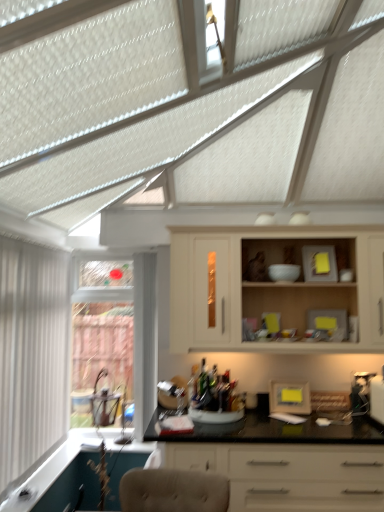
Question: From the image's perspective, would you say yellow matte frame at center is shown under white vertical blinds at left, the 2th window from the back?

Choices:
 (A) yes
 (B) no

Answer: (A)

Question: Is yellow matte frame at center completely or partially outside of white vertical blinds at left, the 2th window from the back?

Choices:
 (A) no
 (B) yes

Answer: (B)

Question: Considering the relative positions of yellow matte frame at center and white vertical blinds at left, which ranks as the 1th window in front-to-back order, in the image provided, is yellow matte frame at center to the right of white vertical blinds at left, which ranks as the 1th window in front-to-back order, from the viewer's perspective?

Choices:
 (A) yes
 (B) no

Answer: (A)

Question: Considering the relative sizes of yellow matte frame at center and white vertical blinds at left, the 2th window from the back, in the image provided, is yellow matte frame at center smaller than white vertical blinds at left, the 2th window from the back,?

Choices:
 (A) yes
 (B) no

Answer: (A)

Question: Is yellow matte frame at center to the left of white vertical blinds at left, which ranks as the 1th window in front-to-back order, from the viewer's perspective?

Choices:
 (A) yes
 (B) no

Answer: (B)

Question: In terms of size, does clear glass window at left, which is the second window from front to back, appear bigger or smaller than yellow matte frame at center?

Choices:
 (A) small
 (B) big

Answer: (B)

Question: Visually, is clear glass window at left, which is the second window from front to back, positioned to the left or to the right of yellow matte frame at center?

Choices:
 (A) left
 (B) right

Answer: (A)

Question: Considering their positions, is clear glass window at left, which is the second window from front to back, located in front of or behind yellow matte frame at center?

Choices:
 (A) behind
 (B) front

Answer: (A)

Question: Choose the correct answer: Is clear glass window at left, positioned as the first window in back-to-front order, inside yellow matte frame at center or outside it?

Choices:
 (A) inside
 (B) outside

Answer: (B)

Question: Is clear glass window at left, positioned as the first window in back-to-front order, spatially inside matte cream cabinet at center, or outside of it?

Choices:
 (A) inside
 (B) outside

Answer: (B)

Question: Is clear glass window at left, positioned as the first window in back-to-front order, wider or thinner than matte cream cabinet at center?

Choices:
 (A) thin
 (B) wide

Answer: (A)

Question: From a real-world perspective, is clear glass window at left, which is the second window from front to back, positioned above or below matte cream cabinet at center?

Choices:
 (A) above
 (B) below

Answer: (B)

Question: Does point (139, 286) appear closer or farther from the camera than point (231, 252)?

Choices:
 (A) closer
 (B) farther

Answer: (B)

Question: From a real-world perspective, is matte cream cabinet at center physically located above or below white vertical blinds at left, which ranks as the 1th window in front-to-back order?

Choices:
 (A) above
 (B) below

Answer: (A)

Question: Choose the correct answer: Is matte cream cabinet at center inside white vertical blinds at left, the 2th window from the back, or outside it?

Choices:
 (A) outside
 (B) inside

Answer: (A)